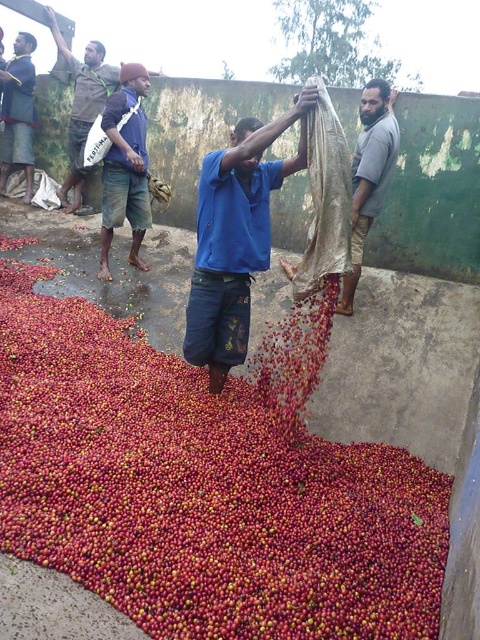
Question: Considering the relative positions of red matte coffee beans at center and blue fabric at center in the image provided, where is red matte coffee beans at center located with respect to blue fabric at center?

Choices:
 (A) left
 (B) right

Answer: (A)

Question: Which object is farther from the camera taking this photo?

Choices:
 (A) red matte coffee beans at center
 (B) blue fabric bag at upper left
 (C) brown leather jacket at upper left
 (D) gray cotton shirt at upper right

Answer: (C)

Question: Observing the image, what is the correct spatial positioning of blue fabric at center in reference to gray cotton shirt at upper right?

Choices:
 (A) below
 (B) above

Answer: (A)

Question: Estimate the real-world distances between objects in this image. Which object is farther from the red matte coffee beans at center?

Choices:
 (A) gray cotton shirt at upper right
 (B) brown leather jacket at upper left

Answer: (B)

Question: Estimate the real-world distances between objects in this image. Which object is farther from the brown cotton shirt at upper left?

Choices:
 (A) brown leather jacket at upper left
 (B) red matte coffee beans at center
 (C) gray cotton shirt at upper right
 (D) blue fabric bag at upper left

Answer: (B)

Question: Is blue fabric at center further to the viewer compared to blue fabric bag at upper left?

Choices:
 (A) yes
 (B) no

Answer: (B)